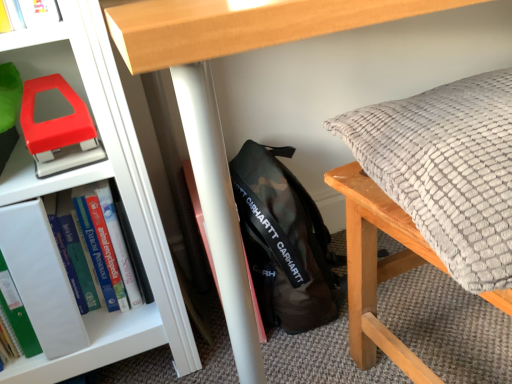
Question: Does point (468, 114) appear closer or farther from the camera than point (40, 251)?

Choices:
 (A) farther
 (B) closer

Answer: (B)

Question: Would you say textured gray pillow at right is to the left or to the right of hardcover book at left in the picture?

Choices:
 (A) left
 (B) right

Answer: (B)

Question: Considering the real-world distances, which object is farthest from the camo fabric backpack at center?

Choices:
 (A) matte plastic stapler at left
 (B) textured gray pillow at right
 (C) hardcover book at left

Answer: (A)

Question: Considering the real-world distances, which object is farthest from the matte plastic stapler at left?

Choices:
 (A) hardcover book at left
 (B) camo fabric backpack at center
 (C) textured gray pillow at right

Answer: (C)